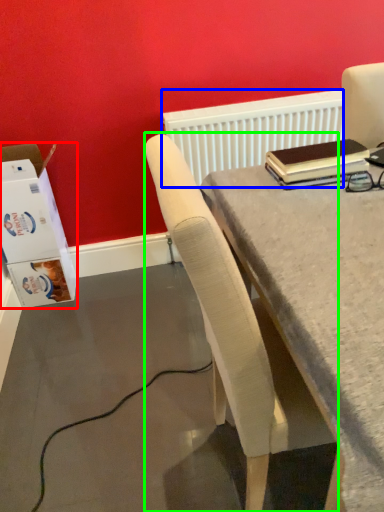
Question: Based on their relative distances, which object is farther from box (highlighted by a red box)? Choose from radiator (highlighted by a blue box) and chair (highlighted by a green box).

Choices:
 (A) radiator
 (B) chair

Answer: (B)